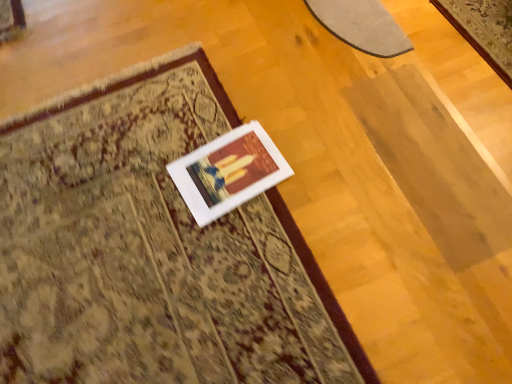
Question: Could beige carpet at center, which ranks as the 1th mat in left-to-right order, be considered to be inside matte gray rug at upper right, which is counted as the second mat, starting from the bottom?

Choices:
 (A) no
 (B) yes

Answer: (A)

Question: Considering the relative sizes of matte gray rug at upper right, which ranks as the first mat in top-to-bottom order, and beige carpet at center, which ranks as the 1th mat in left-to-right order, in the image provided, is matte gray rug at upper right, which ranks as the first mat in top-to-bottom order, taller than beige carpet at center, which ranks as the 1th mat in left-to-right order,?

Choices:
 (A) no
 (B) yes

Answer: (B)

Question: Is matte gray rug at upper right, which ranks as the first mat in top-to-bottom order, to the right of beige carpet at center, which ranks as the 1th mat in left-to-right order, from the viewer's perspective?

Choices:
 (A) no
 (B) yes

Answer: (B)

Question: Does matte gray rug at upper right, which is counted as the second mat, starting from the bottom, have a lesser height compared to beige carpet at center, acting as the 2th mat starting from the back?

Choices:
 (A) no
 (B) yes

Answer: (A)

Question: From the image's perspective, is beige carpet at center, acting as the 2th mat starting from the back, positioned above or below white matte picture frame at center?

Choices:
 (A) below
 (B) above

Answer: (A)

Question: From their relative heights in the image, would you say beige carpet at center, which ranks as the 1th mat in left-to-right order, is taller or shorter than white matte picture frame at center?

Choices:
 (A) tall
 (B) short

Answer: (A)

Question: Considering the positions of beige carpet at center, the 1th mat positioned from the bottom, and white matte picture frame at center in the image, is beige carpet at center, the 1th mat positioned from the bottom, wider or thinner than white matte picture frame at center?

Choices:
 (A) wide
 (B) thin

Answer: (A)

Question: Considering their positions, is beige carpet at center, which is the 2th mat from right to left, located in front of or behind white matte picture frame at center?

Choices:
 (A) front
 (B) behind

Answer: (A)

Question: Is point (353, 9) closer or farther from the camera than point (234, 243)?

Choices:
 (A) closer
 (B) farther

Answer: (B)

Question: From the image's perspective, relative to beige carpet at center, acting as the 2th mat starting from the back, is matte gray rug at upper right, which ranks as the first mat in top-to-bottom order, above or below?

Choices:
 (A) below
 (B) above

Answer: (B)

Question: Is matte gray rug at upper right, which is counted as the second mat, starting from the bottom, to the left or to the right of beige carpet at center, acting as the 2th mat starting from the back, in the image?

Choices:
 (A) right
 (B) left

Answer: (A)

Question: Based on their sizes in the image, would you say matte gray rug at upper right, the second mat when ordered from front to back, is bigger or smaller than beige carpet at center, the 1th mat positioned from the bottom?

Choices:
 (A) small
 (B) big

Answer: (A)

Question: Is point (407, 41) closer or farther from the camera than point (262, 170)?

Choices:
 (A) closer
 (B) farther

Answer: (B)

Question: In terms of width, does matte gray rug at upper right, which ranks as the first mat in top-to-bottom order, look wider or thinner when compared to white matte picture frame at center?

Choices:
 (A) thin
 (B) wide

Answer: (A)